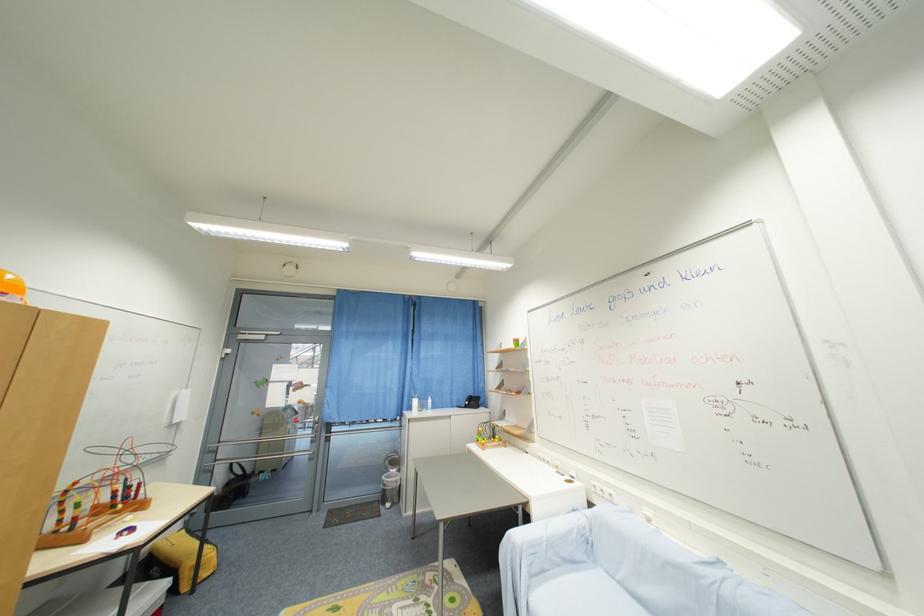
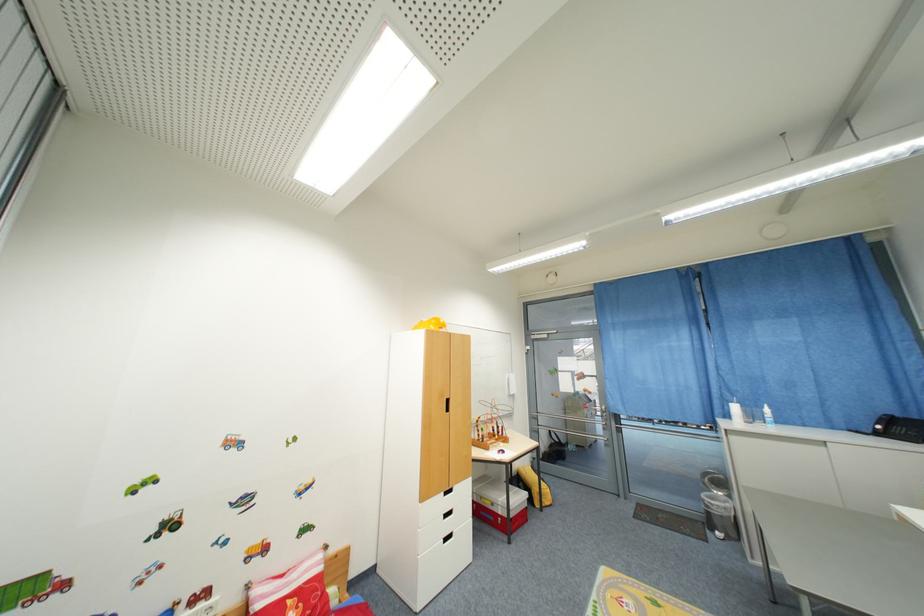
Where in the second image is the point corresponding to the point at 420,403 from the first image?

(740, 410)